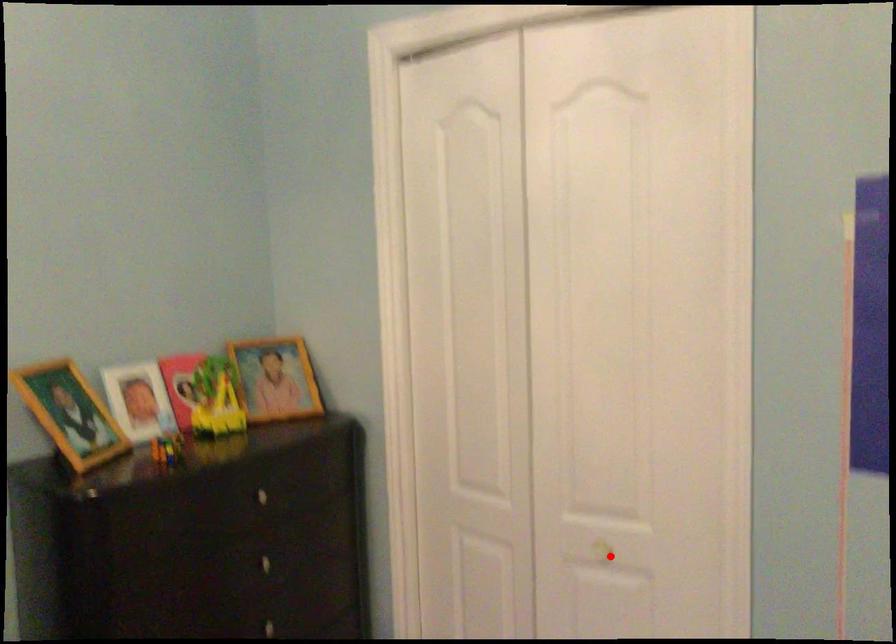
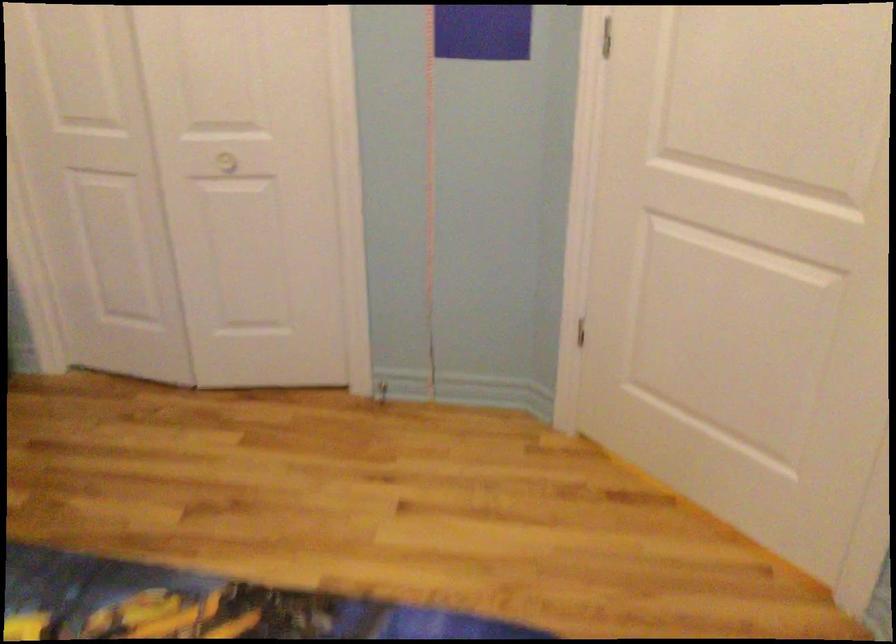
Where in the second image is the point corresponding to the highlighted location from the first image?

(227, 162)